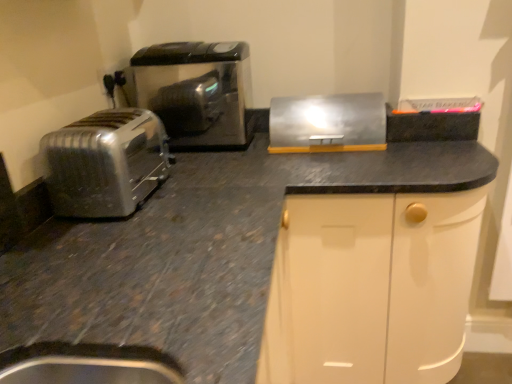
Where is `metallic silver breadbox at upper right`? This screenshot has width=512, height=384. metallic silver breadbox at upper right is located at coordinates (327, 123).

Identify the location of matte black outlet at upper left. This screenshot has width=512, height=384. pyautogui.click(x=113, y=82).

I want to click on metallic silver breadbox at upper right, so pos(327,123).

Considering the sizes of objects satin black toaster at left and metallic silver breadbox at upper right in the image provided, who is taller, satin black toaster at left or metallic silver breadbox at upper right?

satin black toaster at left is taller.

Where is `kitchen appliance in front of the satin black toaster at left`? The width and height of the screenshot is (512, 384). kitchen appliance in front of the satin black toaster at left is located at coordinates (327, 123).

From the image's perspective, which is below, satin black toaster at left or metallic silver breadbox at upper right?

From the image's view, metallic silver breadbox at upper right is below.

From a real-world perspective, relative to satin black toaster at left, is metallic silver breadbox at upper right vertically above or below?

Clearly, from a real-world perspective, metallic silver breadbox at upper right is below satin black toaster at left.

Image resolution: width=512 pixels, height=384 pixels. Find the location of `kitchen appliance below the satin black toaster at left (from a real-world perspective)`. kitchen appliance below the satin black toaster at left (from a real-world perspective) is located at coordinates (327, 123).

From the image's perspective, between metallic silver breadbox at upper right and satin black toaster at left, which one is located above?

satin black toaster at left.

Based on the photo, considering the sizes of objects satin black toaster at left and satin silver toaster at left in the image provided, who is smaller, satin black toaster at left or satin silver toaster at left?

satin silver toaster at left.

From a real-world perspective, between satin black toaster at left and satin silver toaster at left, who is vertically higher?

From a 3D spatial view, satin black toaster at left is above.

Which is less distant, (201, 125) or (121, 201)?

The point (121, 201) is closer to the camera.

From the image's perspective, between satin black toaster at left and satin silver toaster at left, which one is located above?

satin black toaster at left appears higher in the image.

Is matte black outlet at upper left facing towards metallic silver breadbox at upper right?

Yes, matte black outlet at upper left faces towards metallic silver breadbox at upper right.

Is matte black outlet at upper left bigger or smaller than metallic silver breadbox at upper right?

matte black outlet at upper left is smaller than metallic silver breadbox at upper right.

Between matte black outlet at upper left and metallic silver breadbox at upper right, which one has smaller width?

With smaller width is matte black outlet at upper left.

Between matte black outlet at upper left and satin silver toaster at left, which one appears on the right side from the viewer's perspective?

From the viewer's perspective, satin silver toaster at left appears more on the right side.

Which object is thinner, matte black outlet at upper left or satin silver toaster at left?

matte black outlet at upper left.

Identify the location of toaster lying below the matte black outlet at upper left (from the image's perspective). The width and height of the screenshot is (512, 384). (104, 163).

From a real-world perspective, is matte black outlet at upper left on top of satin silver toaster at left?

Yes.

Is metallic silver breadbox at upper right aimed at matte black outlet at upper left?

No, metallic silver breadbox at upper right is not turned towards matte black outlet at upper left.

Is metallic silver breadbox at upper right far away from matte black outlet at upper left?

Actually, metallic silver breadbox at upper right and matte black outlet at upper left are a little close together.

From a real-world perspective, is metallic silver breadbox at upper right over matte black outlet at upper left?

Actually, metallic silver breadbox at upper right is physically below matte black outlet at upper left in the real world.

Does metallic silver breadbox at upper right contain matte black outlet at upper left?

No, matte black outlet at upper left is not a part of metallic silver breadbox at upper right.

Considering the relative sizes of satin silver toaster at left and satin black toaster at left in the image provided, is satin silver toaster at left bigger than satin black toaster at left?

Incorrect, satin silver toaster at left is not larger than satin black toaster at left.

How distant is satin silver toaster at left from satin black toaster at left?

satin silver toaster at left and satin black toaster at left are 40.29 centimeters apart.

Are satin silver toaster at left and satin black toaster at left far apart?

No, there isn't a large distance between satin silver toaster at left and satin black toaster at left.

Based on their positions, is satin silver toaster at left located to the left or right of satin black toaster at left?

From the image, it's evident that satin silver toaster at left is to the left of satin black toaster at left.

The image size is (512, 384). What are the coordinates of `home appliance above the metallic silver breadbox at upper right (from a real-world perspective)` in the screenshot? It's located at (196, 90).

The height and width of the screenshot is (384, 512). Find the location of `kitchen appliance on the right of satin black toaster at left`. kitchen appliance on the right of satin black toaster at left is located at coordinates (327, 123).

Looking at the image, which one is located closer to metallic silver breadbox at upper right, satin silver toaster at left or satin black toaster at left?

The object closer to metallic silver breadbox at upper right is satin black toaster at left.

Looking at the image, which one is located closer to satin silver toaster at left, matte black outlet at upper left or metallic silver breadbox at upper right?

Based on the image, matte black outlet at upper left appears to be nearer to satin silver toaster at left.

Which object lies further to the anchor point matte black outlet at upper left, metallic silver breadbox at upper right or satin silver toaster at left?

Based on the image, metallic silver breadbox at upper right appears to be further to matte black outlet at upper left.

When comparing their distances from satin silver toaster at left, does matte black outlet at upper left or satin black toaster at left seem closer?

The object closer to satin silver toaster at left is satin black toaster at left.

Based on their spatial positions, is metallic silver breadbox at upper right or satin silver toaster at left closer to satin black toaster at left?

metallic silver breadbox at upper right lies closer to satin black toaster at left than the other object.

When comparing their distances from metallic silver breadbox at upper right, does satin silver toaster at left or matte black outlet at upper left seem further?

Based on the image, matte black outlet at upper left appears to be further to metallic silver breadbox at upper right.

When comparing their distances from satin black toaster at left, does matte black outlet at upper left or metallic silver breadbox at upper right seem further?

The object further to satin black toaster at left is metallic silver breadbox at upper right.

Based on their spatial positions, is satin silver toaster at left or metallic silver breadbox at upper right closer to satin black toaster at left?

metallic silver breadbox at upper right is positioned closer to the anchor satin black toaster at left.

The image size is (512, 384). I want to click on toaster between matte black outlet at upper left and metallic silver breadbox at upper right in the horizontal direction, so click(x=104, y=163).

Locate an element on the screen. The image size is (512, 384). home appliance located between matte black outlet at upper left and metallic silver breadbox at upper right in the left-right direction is located at coordinates (196, 90).

Locate an element on the screen. The height and width of the screenshot is (384, 512). home appliance between satin silver toaster at left and metallic silver breadbox at upper right in the horizontal direction is located at coordinates (196, 90).

Locate an element on the screen. This screenshot has height=384, width=512. home appliance located between satin silver toaster at left and matte black outlet at upper left in the depth direction is located at coordinates (196, 90).